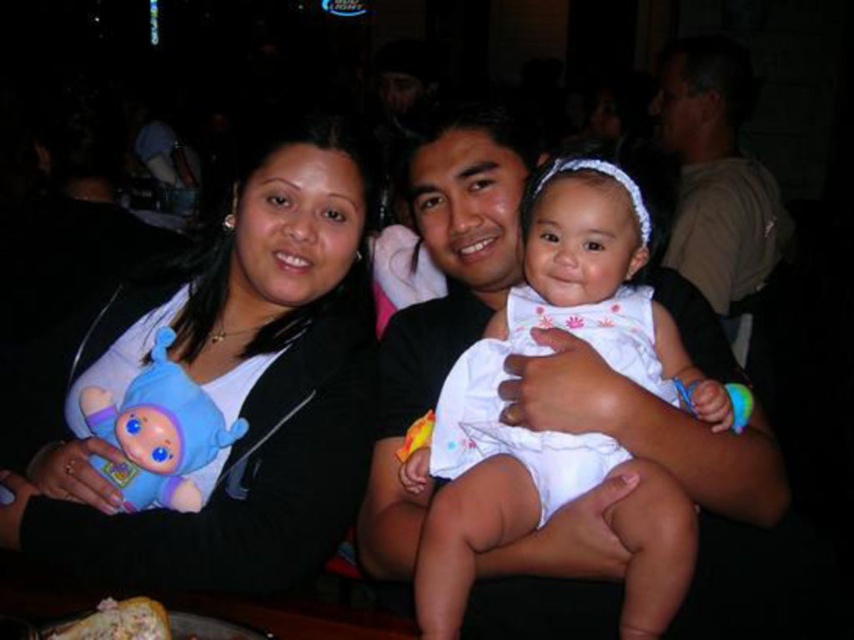
Question: Among these points, which one is farthest from the camera?

Choices:
 (A) pyautogui.click(x=703, y=184)
 (B) pyautogui.click(x=208, y=406)
 (C) pyautogui.click(x=268, y=131)
 (D) pyautogui.click(x=454, y=371)

Answer: (A)

Question: Does white cotton dress at center come behind matte khaki shirt at upper right?

Choices:
 (A) no
 (B) yes

Answer: (A)

Question: Can you confirm if matte khaki shirt at upper right is positioned below blue plush toy at left?

Choices:
 (A) yes
 (B) no

Answer: (B)

Question: Which of these objects is positioned closest to the white cotton dress at center?

Choices:
 (A) matte khaki shirt at upper right
 (B) matte black jacket at upper left

Answer: (B)

Question: Is matte khaki shirt at upper right below blue plush toy at left?

Choices:
 (A) yes
 (B) no

Answer: (B)

Question: Among these objects, which one is nearest to the camera?

Choices:
 (A) matte khaki shirt at upper right
 (B) matte black jacket at upper left
 (C) blue plush toy at left
 (D) white cotton dress at center

Answer: (D)